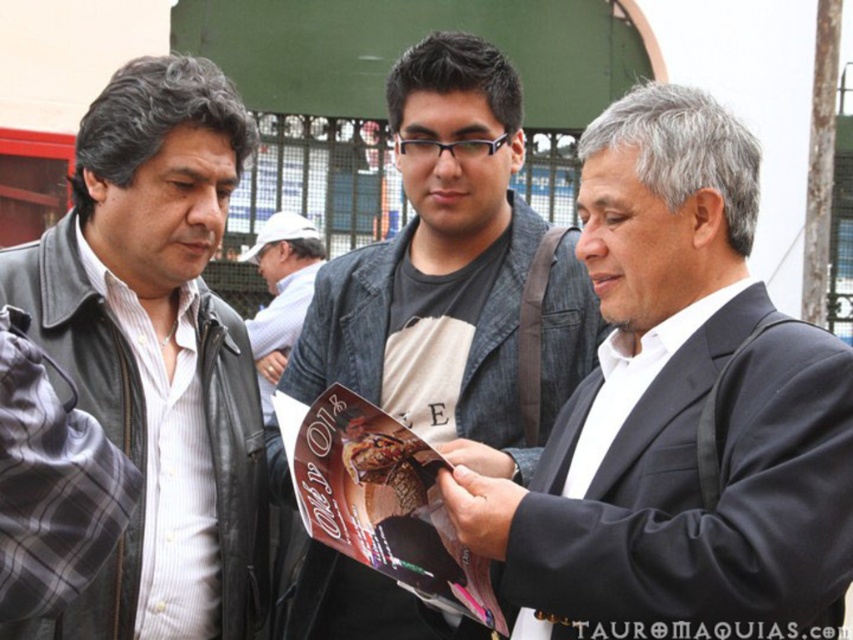
In the scene shown: You are a tailor observing a man wearing a black suit jacket at center and a light gray fabric shirt at center. Which clothing item is taller?

The black suit jacket at center is much taller than the light gray fabric shirt at center.

Based on the scene description, which clothing item is positioned lower on the central figure? The black suit jacket at center or the light gray fabric shirt at center?

The black suit jacket at center is located below the light gray fabric shirt at center, so the black suit jacket at center is positioned lower.

You are standing in front of the group of three men and want to determine which of the two points, point (474, 104) or point (349, 392), is closer to you. Based on the scene, which point is nearer?

Point (474, 104) is closer to you because it is further to the viewer than point (349, 392) according to the description.